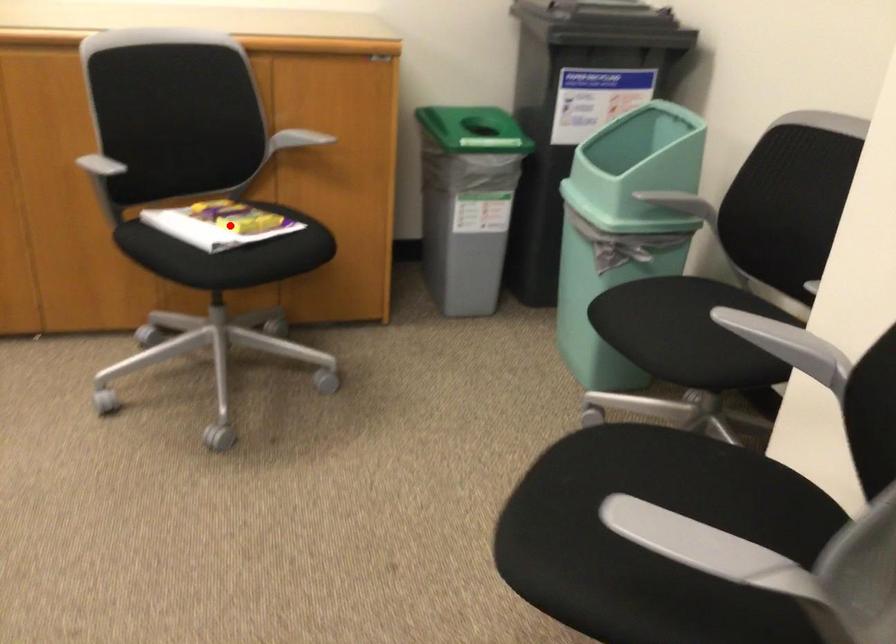
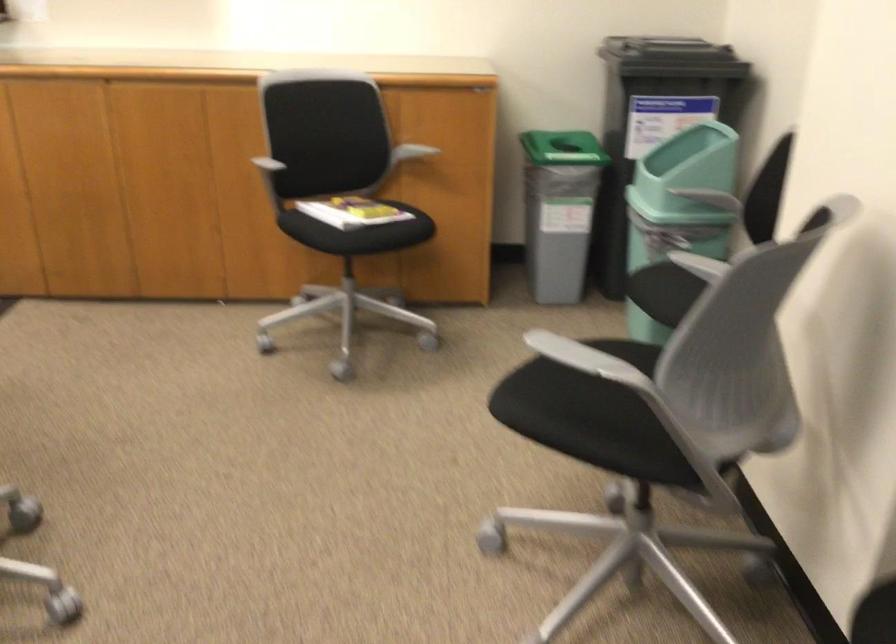
Question: I am providing you with two images of the same scene from different viewpoints. Image1 has a red point marked. In image2, the corresponding 3D location appears at what relative position? Reply with the corresponding letter.

Choices:
 (A) Closer
 (B) Farther

Answer: (B)